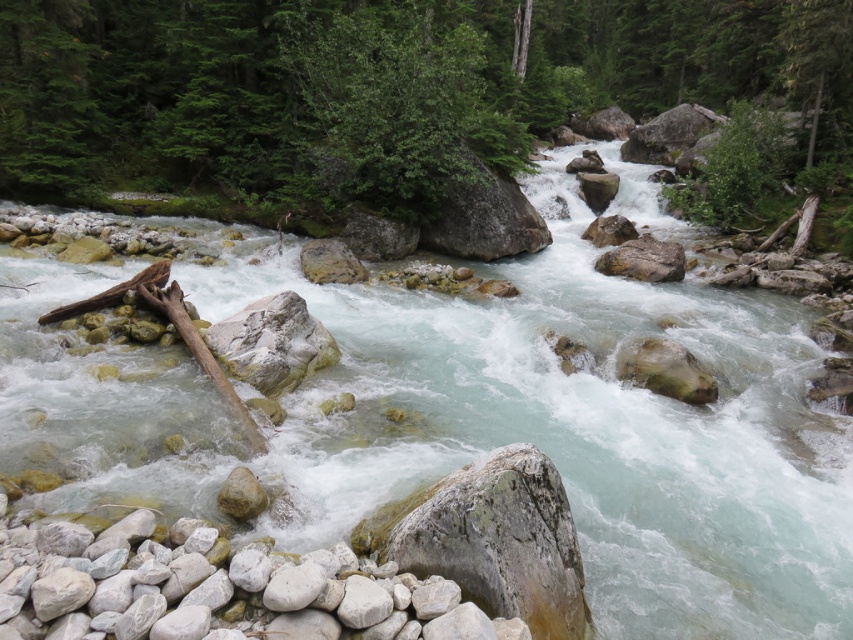
You are a hiker who has just arrived at the riverbank. You see a point marked at coordinates (386, 88). What object is located at that point?

The point at coordinates (386, 88) indicates a green leafy tree at center.

You are a hiker standing on the riverbank and want to take a photo of both the green leafy tree at center and the smooth gray rock at center. Which object should you focus on first if you want to capture both in the same frame without moving your camera?

The green leafy tree at center is taller than the smooth gray rock at center, so you should focus on the green leafy tree at center first to ensure both fit in the frame.